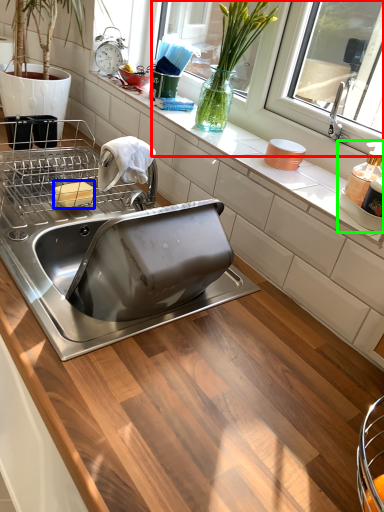
Question: Which object is positioned farthest from window screen (highlighted by a red box)? Select from food (highlighted by a blue box) and appliance (highlighted by a green box).

Choices:
 (A) food
 (B) appliance

Answer: (A)